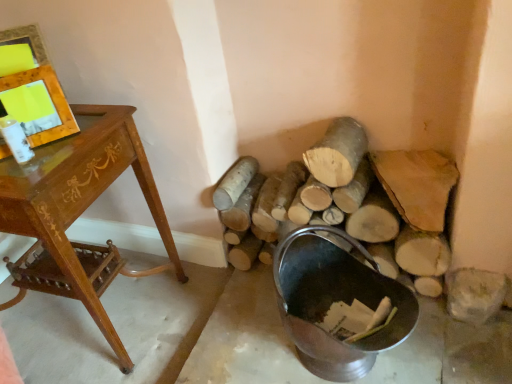
The height and width of the screenshot is (384, 512). I want to click on vacant space to the right of metallic bucket at lower right, so click(x=452, y=344).